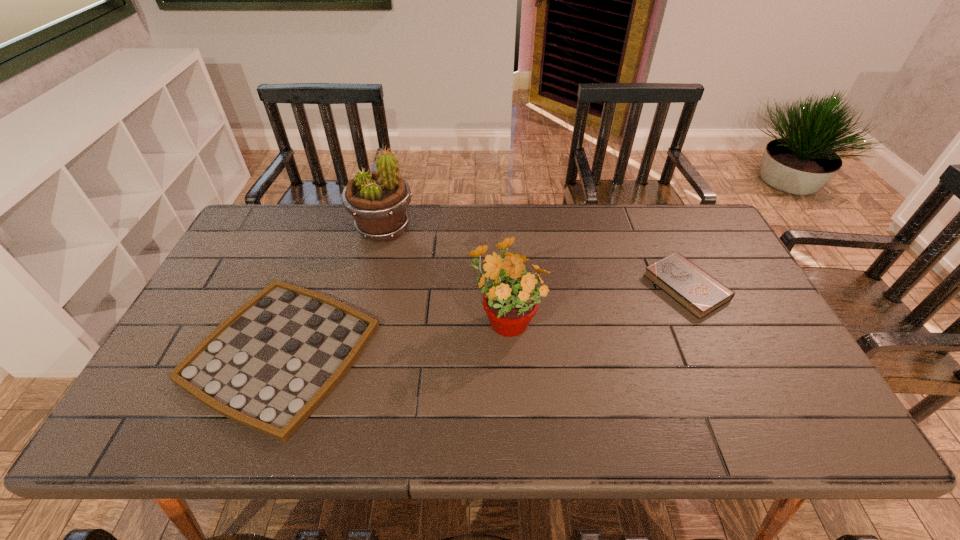
Where is `free spot located on the right of the checkerboard`? free spot located on the right of the checkerboard is located at coordinates (501, 353).

You are a GUI agent. You are given a task and a screenshot of the screen. Output one action in this format:
    pyautogui.click(x=<x>, y=<y>)
    Task: Click on the object that is at the far edge
    The image size is (960, 540).
    Given the screenshot: What is the action you would take?
    pyautogui.click(x=377, y=200)

In order to click on object that is at the near edge in this screenshot , I will do `click(268, 366)`.

Where is `object that is at the left edge`? The height and width of the screenshot is (540, 960). object that is at the left edge is located at coordinates (268, 366).

Locate an element on the screen. This screenshot has width=960, height=540. object located at the right edge is located at coordinates (693, 288).

This screenshot has width=960, height=540. In order to click on object that is at the near left corner in this screenshot , I will do `click(268, 366)`.

In the image, there is a desktop. Where is `free region at the far edge`? This screenshot has width=960, height=540. free region at the far edge is located at coordinates (422, 225).

I want to click on vacant position at the near edge of the desktop, so click(342, 433).

Identify the location of vacant position at the left edge of the desktop. pos(250,289).

Where is `free space at the right edge of the desktop`? The width and height of the screenshot is (960, 540). free space at the right edge of the desktop is located at coordinates coord(740,374).